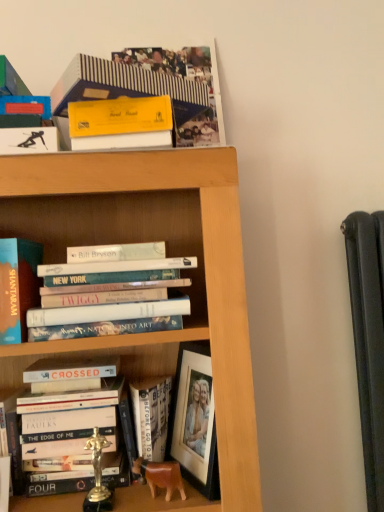
The image size is (384, 512). Identify the location of matte blue book at left, the third book positioned from the bottom. (17, 286).

How much space does hardcover book at lower left, which appears as the 4th book when viewed from the top, occupy vertically?

hardcover book at lower left, which appears as the 4th book when viewed from the top, is 11.32 inches in height.

The image size is (384, 512). I want to click on hardcover books at center, placed as the 2th book when sorted from top to bottom, so click(x=114, y=296).

In order to face hardcover book at center, marked as the 5th book in a top-to-bottom arrangement, should I rotate leftwards or rightwards?

Rotate left and turn 6.140 degrees.

Image resolution: width=384 pixels, height=512 pixels. I want to click on striped paper book at upper center, acting as the first book starting from the top, so click(x=152, y=89).

The image size is (384, 512). What are the coordinates of `matte blue book at left, placed as the 3th book when sorted from top to bottom` in the screenshot? It's located at (17, 286).

Is hardcover book at center, which ranks as the first book in bottom-to-top order, located within hardcover book at lower left, which appears as the 4th book when viewed from the top?

No, hardcover book at center, which ranks as the first book in bottom-to-top order, is located outside of hardcover book at lower left, which appears as the 4th book when viewed from the top.

From the image's perspective, which is above, hardcover book at lower left, which appears as the 4th book when viewed from the top, or hardcover book at center, which ranks as the first book in bottom-to-top order?

From the image's view, hardcover book at lower left, which appears as the 4th book when viewed from the top, is above.

Can you see hardcover book at lower left, marked as the 2th book in a bottom-to-top arrangement, touching hardcover book at center, which ranks as the first book in bottom-to-top order?

They are not placed beside each other.

Between hardcover book at lower left, marked as the 2th book in a bottom-to-top arrangement, and striped paper book at upper center, acting as the first book starting from the top, which one has less height?

striped paper book at upper center, acting as the first book starting from the top.

Is hardcover book at lower left, marked as the 2th book in a bottom-to-top arrangement, inside the boundaries of striped paper book at upper center, acting as the first book starting from the top, or outside?

hardcover book at lower left, marked as the 2th book in a bottom-to-top arrangement, exists outside the volume of striped paper book at upper center, acting as the first book starting from the top.

Considering the relative sizes of hardcover book at lower left, which appears as the 4th book when viewed from the top, and striped paper book at upper center, acting as the first book starting from the top, in the image provided, is hardcover book at lower left, which appears as the 4th book when viewed from the top, thinner than striped paper book at upper center, acting as the first book starting from the top,?

Yes.

Between hardcover book at lower left, marked as the 2th book in a bottom-to-top arrangement, and striped paper book at upper center, acting as the first book starting from the top, which one has smaller size?

With smaller size is striped paper book at upper center, acting as the first book starting from the top.

From the image's perspective, between hardcover books at center, placed as the 2th book when sorted from top to bottom, and striped paper book at upper center, which is the 5th book from bottom to top, which one is located above?

striped paper book at upper center, which is the 5th book from bottom to top, is shown above in the image.

Looking at this image, measure the distance from hardcover books at center, placed as the 2th book when sorted from top to bottom, to striped paper book at upper center, which is the 5th book from bottom to top.

They are 12.85 inches apart.

Considering the positions of objects hardcover books at center, placed as the 2th book when sorted from top to bottom, and striped paper book at upper center, which is the 5th book from bottom to top, in the image provided, who is more to the right, hardcover books at center, placed as the 2th book when sorted from top to bottom, or striped paper book at upper center, which is the 5th book from bottom to top,?

striped paper book at upper center, which is the 5th book from bottom to top.

Consider the image. Which of these two, hardcover books at center, arranged as the fourth book when ordered from the bottom, or striped paper book at upper center, which is the 5th book from bottom to top, is thinner?

hardcover books at center, arranged as the fourth book when ordered from the bottom, is thinner.

Is striped paper book at upper center, which is the 5th book from bottom to top, placed right next to hardcover book at lower left, which appears as the 4th book when viewed from the top?

striped paper book at upper center, which is the 5th book from bottom to top, is not next to hardcover book at lower left, which appears as the 4th book when viewed from the top, and they're not touching.

From the image's perspective, is striped paper book at upper center, which is the 5th book from bottom to top, on top of hardcover book at lower left, which appears as the 4th book when viewed from the top?

Yes, from the image's perspective, striped paper book at upper center, which is the 5th book from bottom to top, is on top of hardcover book at lower left, which appears as the 4th book when viewed from the top.

Considering the relative positions of striped paper book at upper center, which is the 5th book from bottom to top, and hardcover book at lower left, which appears as the 4th book when viewed from the top, in the image provided, is striped paper book at upper center, which is the 5th book from bottom to top, to the right of hardcover book at lower left, which appears as the 4th book when viewed from the top, from the viewer's perspective?

Yes, striped paper book at upper center, which is the 5th book from bottom to top, is to the right of hardcover book at lower left, which appears as the 4th book when viewed from the top.

Does striped paper book at upper center, which is the 5th book from bottom to top, have a lesser width compared to hardcover book at lower left, which appears as the 4th book when viewed from the top?

In fact, striped paper book at upper center, which is the 5th book from bottom to top, might be wider than hardcover book at lower left, which appears as the 4th book when viewed from the top.

Is point (184, 145) positioned after point (148, 413)?

Yes, point (184, 145) is behind point (148, 413).

Are striped paper book at upper center, which is the 5th book from bottom to top, and hardcover book at center, which ranks as the first book in bottom-to-top order, located far from each other?

No.

Considering the sizes of objects striped paper book at upper center, acting as the first book starting from the top, and hardcover book at center, which ranks as the first book in bottom-to-top order, in the image provided, who is bigger, striped paper book at upper center, acting as the first book starting from the top, or hardcover book at center, which ranks as the first book in bottom-to-top order,?

Bigger between the two is striped paper book at upper center, acting as the first book starting from the top.

Is striped paper book at upper center, which is the 5th book from bottom to top, looking in the opposite direction of hardcover book at center, which ranks as the first book in bottom-to-top order?

No.

In the image, is striped paper book at upper center, acting as the first book starting from the top, on the left side or the right side of hardcover books at center, arranged as the fourth book when ordered from the bottom?

striped paper book at upper center, acting as the first book starting from the top, is to the right of hardcover books at center, arranged as the fourth book when ordered from the bottom.

Is striped paper book at upper center, which is the 5th book from bottom to top, far from hardcover books at center, placed as the 2th book when sorted from top to bottom?

No.

How far apart are striped paper book at upper center, acting as the first book starting from the top, and hardcover books at center, placed as the 2th book when sorted from top to bottom?

striped paper book at upper center, acting as the first book starting from the top, is 12.85 inches away from hardcover books at center, placed as the 2th book when sorted from top to bottom.

Who is bigger, striped paper book at upper center, acting as the first book starting from the top, or hardcover books at center, arranged as the fourth book when ordered from the bottom?

hardcover books at center, arranged as the fourth book when ordered from the bottom.

From a real-world perspective, which object rests below the other?

From a 3D spatial view, hardcover book at center, which ranks as the first book in bottom-to-top order, is below.

Which is more distant, (x=77, y=335) or (x=145, y=417)?

The point (x=145, y=417) is more distant.

Considering the sizes of objects hardcover books at center, arranged as the fourth book when ordered from the bottom, and hardcover book at center, which ranks as the first book in bottom-to-top order, in the image provided, who is bigger, hardcover books at center, arranged as the fourth book when ordered from the bottom, or hardcover book at center, which ranks as the first book in bottom-to-top order,?

Bigger between the two is hardcover books at center, arranged as the fourth book when ordered from the bottom.

From the picture: Is the depth of hardcover books at center, placed as the 2th book when sorted from top to bottom, greater than that of hardcover book at center, marked as the 5th book in a top-to-bottom arrangement?

No, it is not.

At what (x,y) coordinates should I click in order to perform the action: click on the 1st book in front of the hardcover book at center, marked as the 5th book in a top-to-bottom arrangement. Please return your answer as a coordinate pair (x, y). The image size is (384, 512). Looking at the image, I should click on (72, 436).

The image size is (384, 512). What are the coordinates of `the 2nd book to the right of the hardcover book at lower left, marked as the 2th book in a bottom-to-top arrangement, starting your count from the anchor` in the screenshot? It's located at (152, 89).

Which object lies further to the anchor point striped paper book at upper center, acting as the first book starting from the top, hardcover book at lower left, marked as the 2th book in a bottom-to-top arrangement, or hardcover books at center, arranged as the fourth book when ordered from the bottom?

hardcover book at lower left, marked as the 2th book in a bottom-to-top arrangement, is positioned further to the anchor striped paper book at upper center, acting as the first book starting from the top.

When comparing their distances from hardcover books at center, arranged as the fourth book when ordered from the bottom, does matte blue book at left, the third book positioned from the bottom, or striped paper book at upper center, which is the 5th book from bottom to top, seem further?

Based on the image, striped paper book at upper center, which is the 5th book from bottom to top, appears to be further to hardcover books at center, arranged as the fourth book when ordered from the bottom.

From the image, which object appears to be nearer to hardcover book at center, which ranks as the first book in bottom-to-top order, hardcover book at lower left, marked as the 2th book in a bottom-to-top arrangement, or matte blue book at left, the third book positioned from the bottom?

Based on the image, hardcover book at lower left, marked as the 2th book in a bottom-to-top arrangement, appears to be nearer to hardcover book at center, which ranks as the first book in bottom-to-top order.

When comparing their distances from hardcover book at center, which ranks as the first book in bottom-to-top order, does striped paper book at upper center, which is the 5th book from bottom to top, or matte blue book at left, the third book positioned from the bottom, seem closer?

matte blue book at left, the third book positioned from the bottom.

Looking at the image, which one is located closer to matte blue book at left, placed as the 3th book when sorted from top to bottom, hardcover books at center, arranged as the fourth book when ordered from the bottom, or striped paper book at upper center, acting as the first book starting from the top?

hardcover books at center, arranged as the fourth book when ordered from the bottom.

Based on their spatial positions, is striped paper book at upper center, acting as the first book starting from the top, or matte blue book at left, the third book positioned from the bottom, further from hardcover books at center, arranged as the fourth book when ordered from the bottom?

Based on the image, striped paper book at upper center, acting as the first book starting from the top, appears to be further to hardcover books at center, arranged as the fourth book when ordered from the bottom.

Based on their spatial positions, is striped paper book at upper center, acting as the first book starting from the top, or hardcover book at lower left, which appears as the 4th book when viewed from the top, further from hardcover books at center, arranged as the fourth book when ordered from the bottom?

striped paper book at upper center, acting as the first book starting from the top, is further to hardcover books at center, arranged as the fourth book when ordered from the bottom.

From the image, which object appears to be nearer to hardcover book at center, which ranks as the first book in bottom-to-top order, matte blue book at left, the third book positioned from the bottom, or hardcover books at center, arranged as the fourth book when ordered from the bottom?

Among the two, hardcover books at center, arranged as the fourth book when ordered from the bottom, is located nearer to hardcover book at center, which ranks as the first book in bottom-to-top order.

At what (x,y) coordinates should I click in order to perform the action: click on book that lies between striped paper book at upper center, acting as the first book starting from the top, and matte blue book at left, the third book positioned from the bottom, from top to bottom. Please return your answer as a coordinate pair (x, y). This screenshot has width=384, height=512. Looking at the image, I should click on (114, 296).

Identify the location of book between hardcover books at center, placed as the 2th book when sorted from top to bottom, and hardcover book at lower left, marked as the 2th book in a bottom-to-top arrangement, from top to bottom. (17, 286).

This screenshot has width=384, height=512. Find the location of `book between matte blue book at left, placed as the 3th book when sorted from top to bottom, and hardcover book at center, which ranks as the first book in bottom-to-top order, in the vertical direction`. book between matte blue book at left, placed as the 3th book when sorted from top to bottom, and hardcover book at center, which ranks as the first book in bottom-to-top order, in the vertical direction is located at coordinates (72, 436).